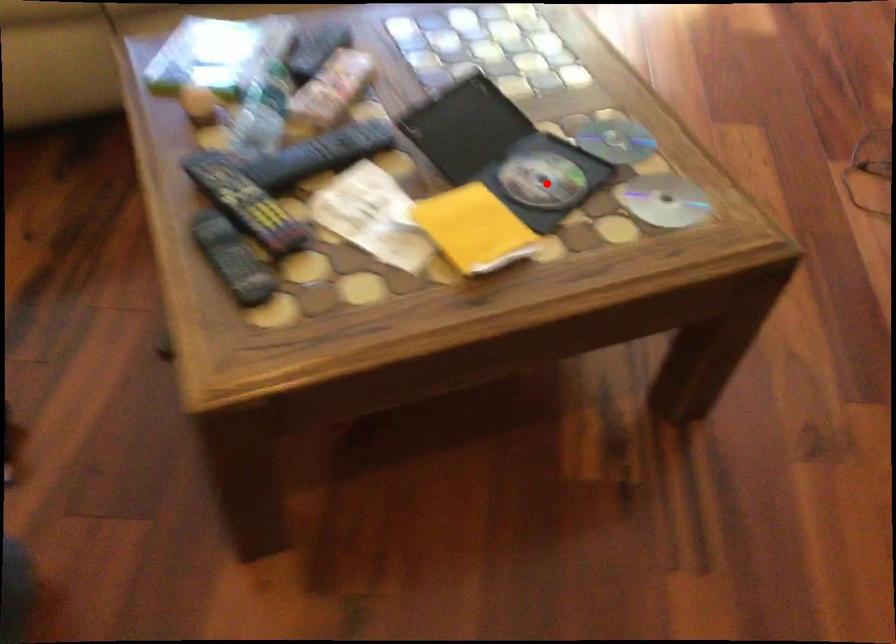
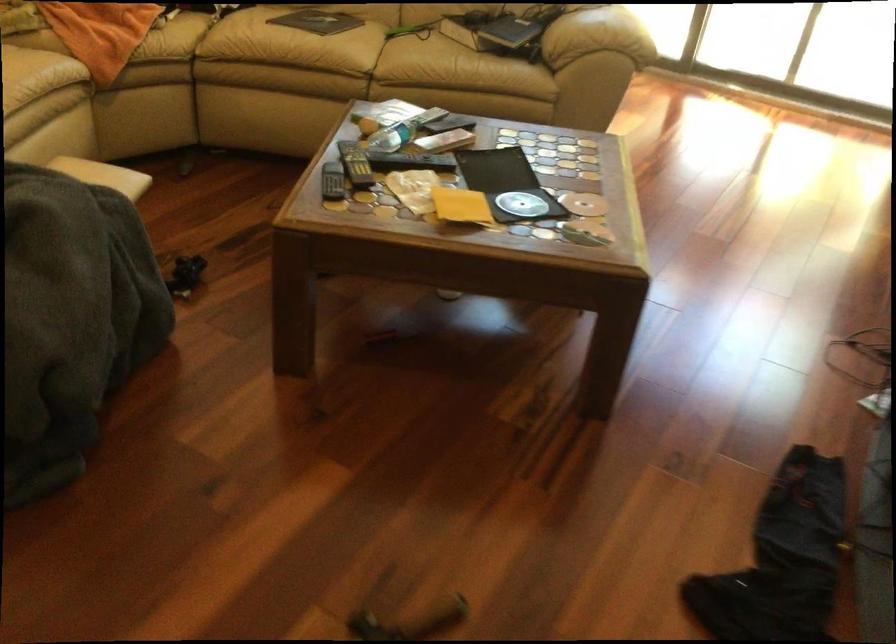
The point at the highlighted location is marked in the first image. Where is the corresponding point in the second image?

(521, 204)